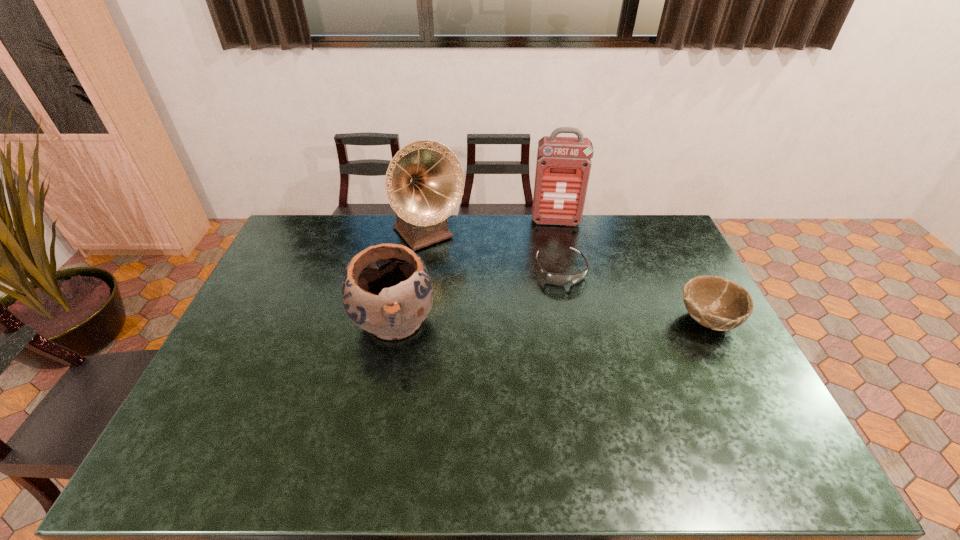
The image size is (960, 540). Find the location of `free space on the desktop that is between the third tallest object and the second shortest object and is positioned on the lenses of the shortest object`. free space on the desktop that is between the third tallest object and the second shortest object and is positioned on the lenses of the shortest object is located at coordinates pos(586,321).

Locate an element on the screen. free space on the desktop that is between the third shortest object and the rightmost object and is positioned on the front-facing side of the first-aid kit is located at coordinates (562, 321).

This screenshot has width=960, height=540. What are the coordinates of `vacant space on the desktop that is between the third tallest object and the bowl and is positioned on the horn of the phonograph record` in the screenshot? It's located at (506, 321).